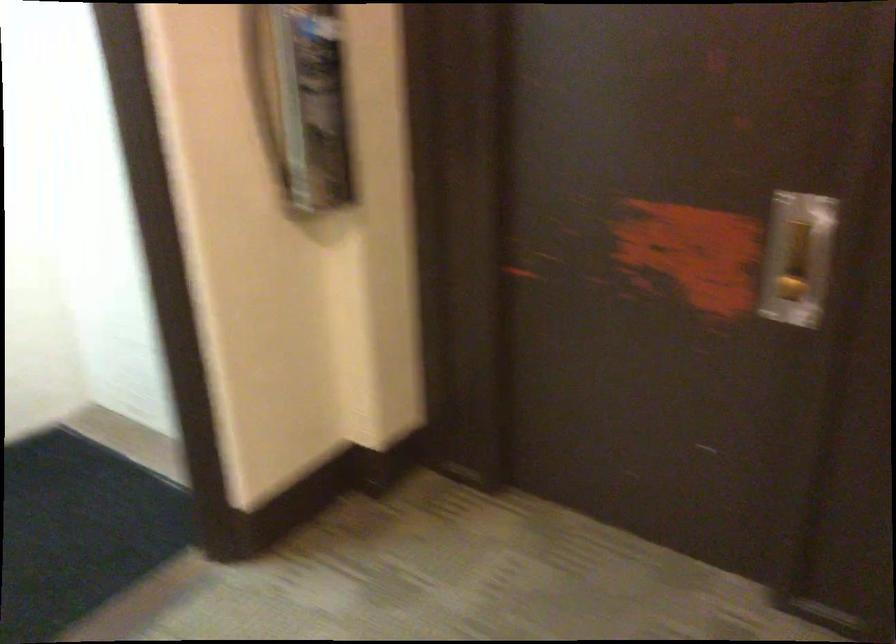
The height and width of the screenshot is (644, 896). Identify the location of recessed door handle. (797, 258).